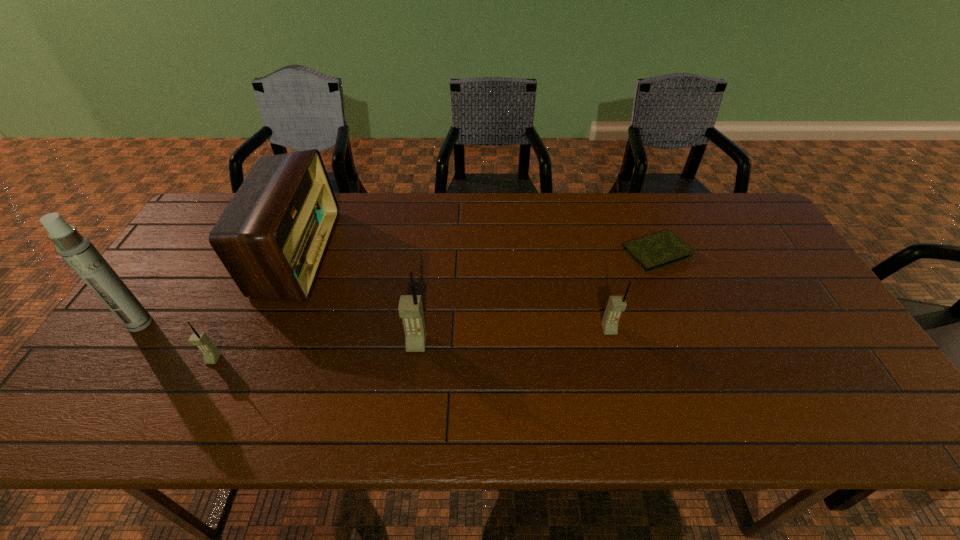
The image size is (960, 540). Find the location of `vacant area that lies between the nearest object and the rightmost object`. vacant area that lies between the nearest object and the rightmost object is located at coordinates (435, 306).

Find the location of `free point between the tallest cellular telephone and the tallest object`. free point between the tallest cellular telephone and the tallest object is located at coordinates (278, 334).

Where is `blank region between the radio receiver and the third shortest object`? This screenshot has width=960, height=540. blank region between the radio receiver and the third shortest object is located at coordinates (452, 292).

Where is `free area in between the tallest cellular telephone and the tallest object`? This screenshot has height=540, width=960. free area in between the tallest cellular telephone and the tallest object is located at coordinates (278, 334).

Where is `unoccupied area between the tallest object and the second shortest cellular telephone`? This screenshot has height=540, width=960. unoccupied area between the tallest object and the second shortest cellular telephone is located at coordinates (374, 327).

You are a GUI agent. You are given a task and a screenshot of the screen. Output one action in this format:
    pyautogui.click(x=<x>, y=<y>)
    Task: Click on the free spot between the third object from right to left and the tallest object
    Image resolution: width=960 pixels, height=540 pixels.
    Given the screenshot: What is the action you would take?
    pyautogui.click(x=278, y=334)

This screenshot has width=960, height=540. I want to click on the closest object to the shortest object, so click(616, 304).

Point out which object is positioned as the second nearest to the shortest object. Please provide its 2D coordinates. Your answer should be formatted as a tuple, i.e. [(x, y)], where the tuple contains the x and y coordinates of a point satisfying the conditions above.

[(410, 307)]

Locate an element on the screen. the second closest cellular telephone relative to the radio receiver is located at coordinates (410, 307).

In order to click on the second closest cellular telephone to the third object from right to left in this screenshot , I will do click(211, 354).